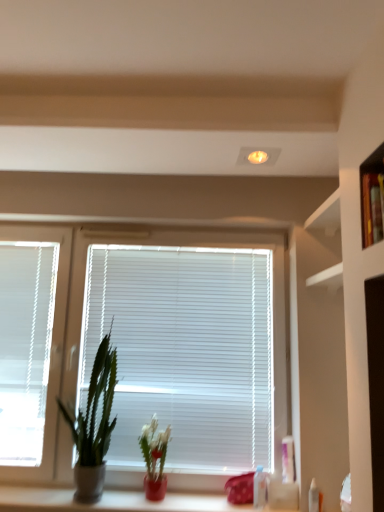
Question: Is green matte plant at left, which ranks as the 1th houseplant in left-to-right order, not near white plastic blinds at left?

Choices:
 (A) no
 (B) yes

Answer: (A)

Question: Can you confirm if green matte plant at left, the second houseplant in the right-to-left sequence, is positioned to the right of white plastic blinds at left?

Choices:
 (A) no
 (B) yes

Answer: (B)

Question: From the image's perspective, is green matte plant at left, the second houseplant in the right-to-left sequence, located above white plastic blinds at left?

Choices:
 (A) yes
 (B) no

Answer: (B)

Question: Can you confirm if green matte plant at left, the second houseplant in the right-to-left sequence, is taller than white plastic blinds at left?

Choices:
 (A) yes
 (B) no

Answer: (B)

Question: Is green matte plant at left, which ranks as the 1th houseplant in left-to-right order, positioned behind white plastic blinds at left?

Choices:
 (A) yes
 (B) no

Answer: (B)

Question: Based on their positions, is matte ceramic plant at lower center, which appears as the second houseplant when viewed from the left, located to the left or right of green matte plant at left, the second houseplant in the right-to-left sequence?

Choices:
 (A) right
 (B) left

Answer: (A)

Question: Looking at their shapes, would you say matte ceramic plant at lower center, which appears as the second houseplant when viewed from the left, is wider or thinner than green matte plant at left, which ranks as the 1th houseplant in left-to-right order?

Choices:
 (A) wide
 (B) thin

Answer: (B)

Question: From the image's perspective, relative to green matte plant at left, which ranks as the 1th houseplant in left-to-right order, is matte ceramic plant at lower center, which appears as the second houseplant when viewed from the left, above or below?

Choices:
 (A) above
 (B) below

Answer: (B)

Question: Is matte ceramic plant at lower center, placed as the first houseplant when sorted from right to left, in front of or behind green matte plant at left, the second houseplant in the right-to-left sequence, in the image?

Choices:
 (A) behind
 (B) front

Answer: (A)

Question: Is green matte plant at left, which ranks as the 1th houseplant in left-to-right order, taller or shorter than white plastic bottle at lower right, the first toiletry positioned from the front?

Choices:
 (A) short
 (B) tall

Answer: (B)

Question: Is green matte plant at left, the second houseplant in the right-to-left sequence, in front of or behind white plastic bottle at lower right, the 2th toiletry when ordered from left to right, in the image?

Choices:
 (A) behind
 (B) front

Answer: (B)

Question: From the image's perspective, is green matte plant at left, the second houseplant in the right-to-left sequence, above or below white plastic bottle at lower right, which is the second toiletry in back-to-front order?

Choices:
 (A) above
 (B) below

Answer: (A)

Question: Is point (87, 498) closer or farther from the camera than point (316, 509)?

Choices:
 (A) closer
 (B) farther

Answer: (B)

Question: Does point (152, 438) appear closer or farther from the camera than point (1, 473)?

Choices:
 (A) farther
 (B) closer

Answer: (A)

Question: From a real-world perspective, relative to white plastic blinds at left, is matte ceramic plant at lower center, placed as the first houseplant when sorted from right to left, vertically above or below?

Choices:
 (A) above
 (B) below

Answer: (B)